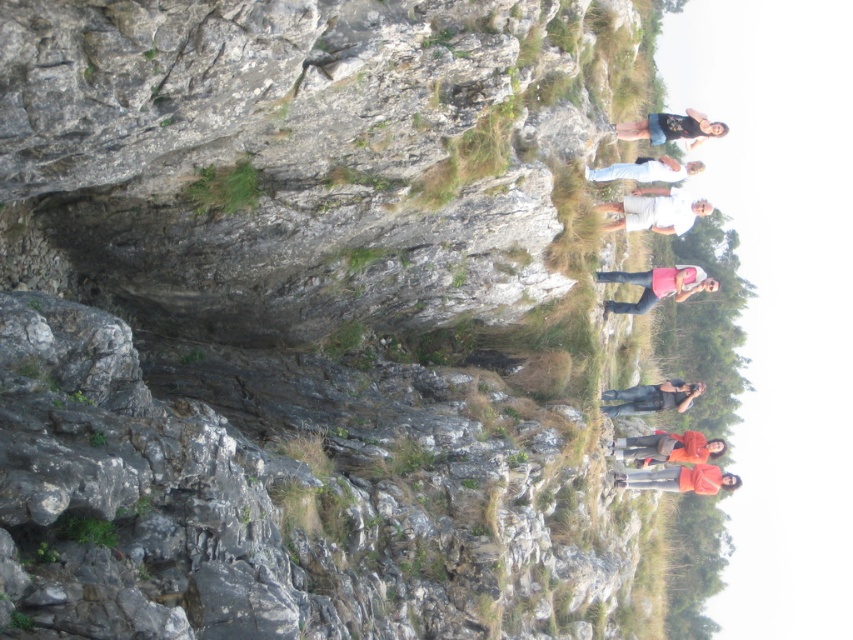
Does point (689, 445) come in front of point (671, 404)?

No, it is not.

Between matte orange shirt at lower right and denim jeans at center, which one appears on the left side from the viewer's perspective?

matte orange shirt at lower right is more to the left.

Where is `matte orange shirt at lower right`? The height and width of the screenshot is (640, 853). matte orange shirt at lower right is located at coordinates (668, 448).

At what (x,y) coordinates should I click in order to perform the action: click on matte orange shirt at lower right. Please return your answer as a coordinate pair (x, y). Looking at the image, I should click on (668, 448).

Is white cotton shirt at center above pink fabric at center?

Yes, white cotton shirt at center is above pink fabric at center.

Is point (651, 205) more distant than point (706, 289)?

No, it is in front of (706, 289).

The width and height of the screenshot is (853, 640). Identify the location of white cotton shirt at center. (654, 212).

Can you confirm if white cotton shirt at center is thinner than denim shorts at upper right?

Correct, white cotton shirt at center's width is less than denim shorts at upper right's.

What do you see at coordinates (654, 212) in the screenshot? The image size is (853, 640). I see `white cotton shirt at center` at bounding box center [654, 212].

Is point (677, 202) closer to viewer compared to point (651, 144)?

Yes.

The image size is (853, 640). Identify the location of white cotton shirt at center. tap(654, 212).